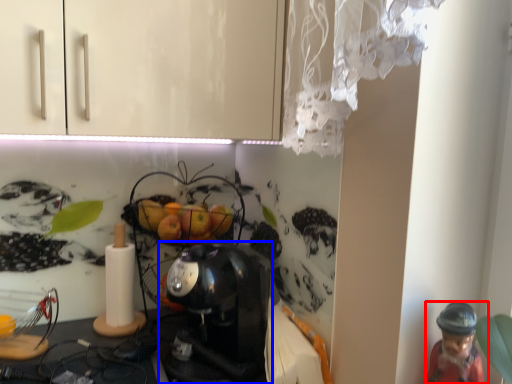
Question: Which of the following is the closest to the observer, person (highlighted by a red box) or coffee maker (highlighted by a blue box)?

Choices:
 (A) person
 (B) coffee maker

Answer: (A)